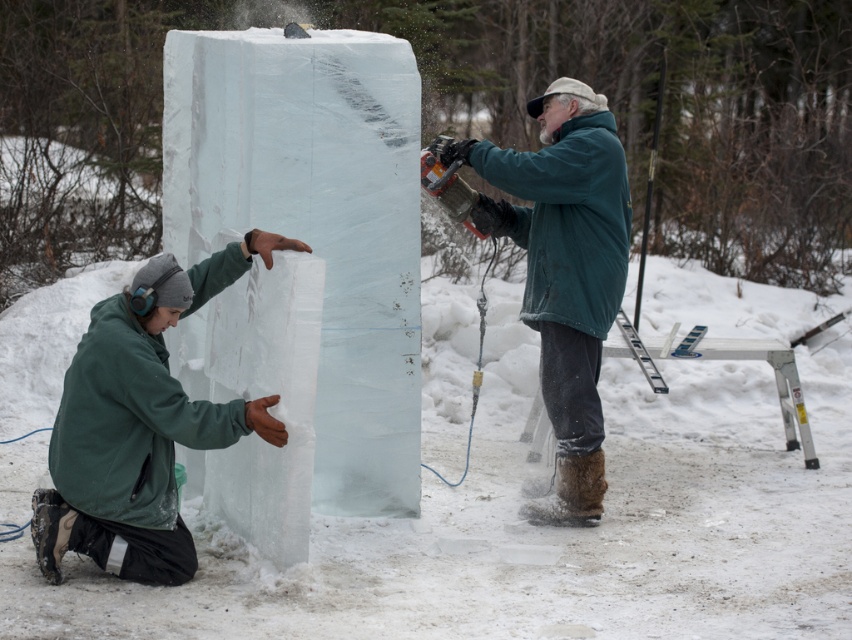
Which is below, green matte jacket at lower left or green matte jacket at center?

Positioned lower is green matte jacket at lower left.

Identify the location of green matte jacket at lower left. The image size is (852, 640). (139, 428).

Identify the location of green matte jacket at lower left. 139,428.